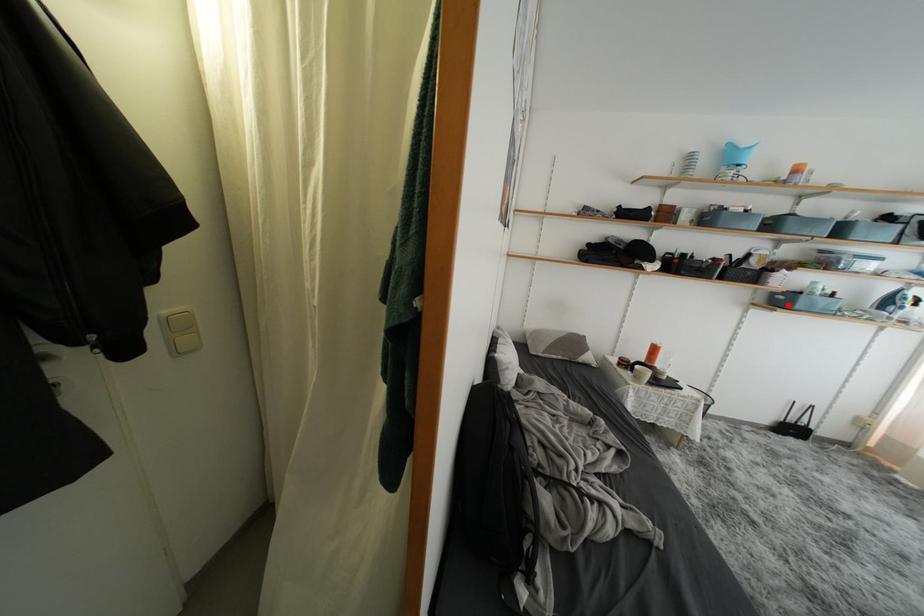
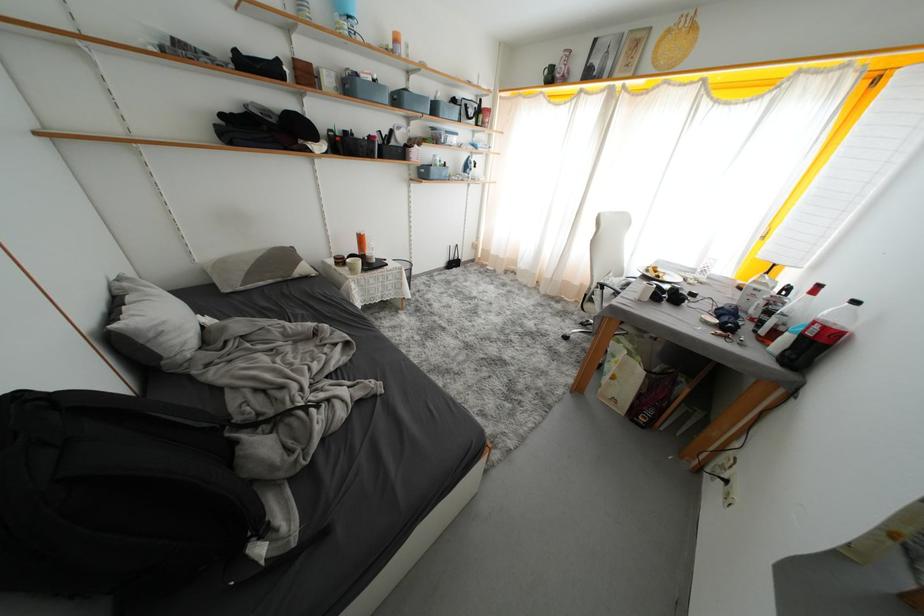
In the second image, find the point that corresponds to the highlighted location in the first image.

(431, 177)